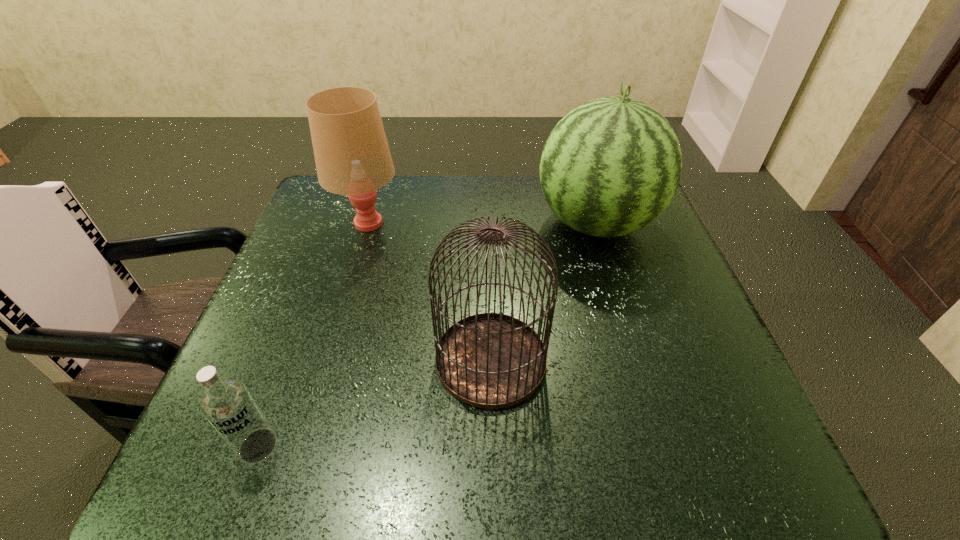
You are a GUI agent. You are given a task and a screenshot of the screen. Output one action in this format:
    pyautogui.click(x=<x>, y=<y>)
    Task: Click on the lampshade at the far edge
    This screenshot has width=960, height=540.
    Given the screenshot: What is the action you would take?
    pyautogui.click(x=352, y=156)

Locate an element on the screen. The width and height of the screenshot is (960, 540). object that is positioned at the near edge is located at coordinates 228,405.

You are a GUI agent. You are given a task and a screenshot of the screen. Output one action in this format:
    pyautogui.click(x=<x>, y=<y>)
    Task: Click on the lampshade located in the left edge section of the desktop
    Image resolution: width=960 pixels, height=540 pixels.
    Given the screenshot: What is the action you would take?
    pyautogui.click(x=352, y=156)

The image size is (960, 540). In order to click on vodka located at the left edge in this screenshot , I will do `click(228, 405)`.

Image resolution: width=960 pixels, height=540 pixels. Find the location of `object located at the right edge`. object located at the right edge is located at coordinates tap(611, 166).

Find the location of a particular element. object that is at the far left corner is located at coordinates (352, 156).

This screenshot has width=960, height=540. What are the coordinates of `object positioned at the near left corner` in the screenshot? It's located at (228, 405).

You are a GUI agent. You are given a task and a screenshot of the screen. Output one action in this format:
    pyautogui.click(x=<x>, y=<y>)
    Task: Click on the object that is at the far right corner
    
    Given the screenshot: What is the action you would take?
    pyautogui.click(x=611, y=166)

The height and width of the screenshot is (540, 960). I want to click on free region at the far edge, so [396, 180].

Where is `vacant space at the near edge`? Image resolution: width=960 pixels, height=540 pixels. vacant space at the near edge is located at coordinates (327, 472).